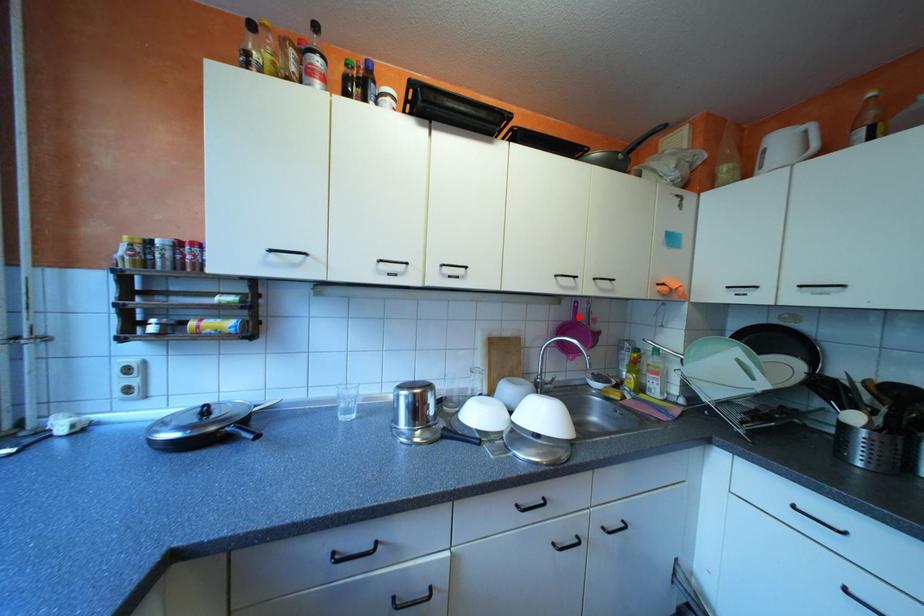
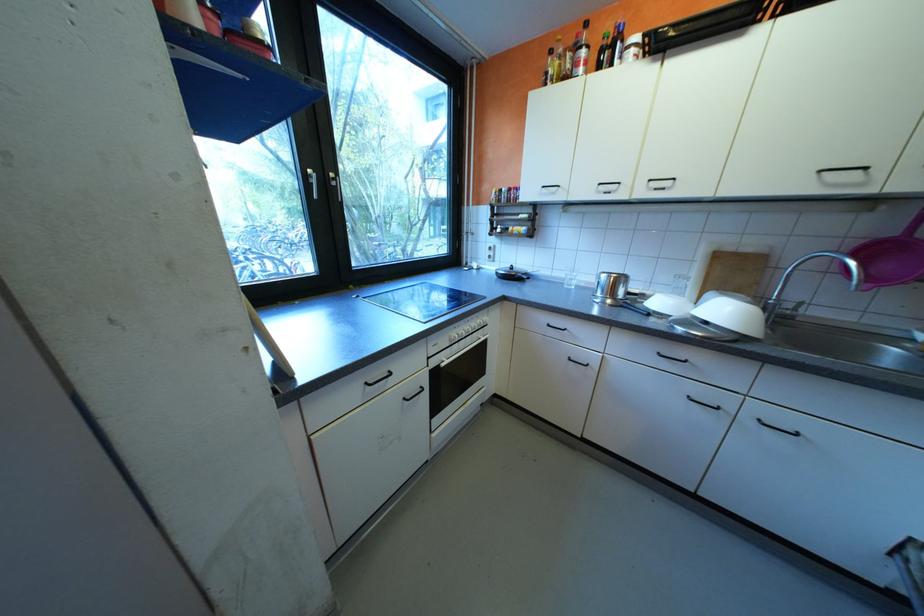
Where in the second image is the point corresponding to the highlighted location from the first image?

(906, 231)